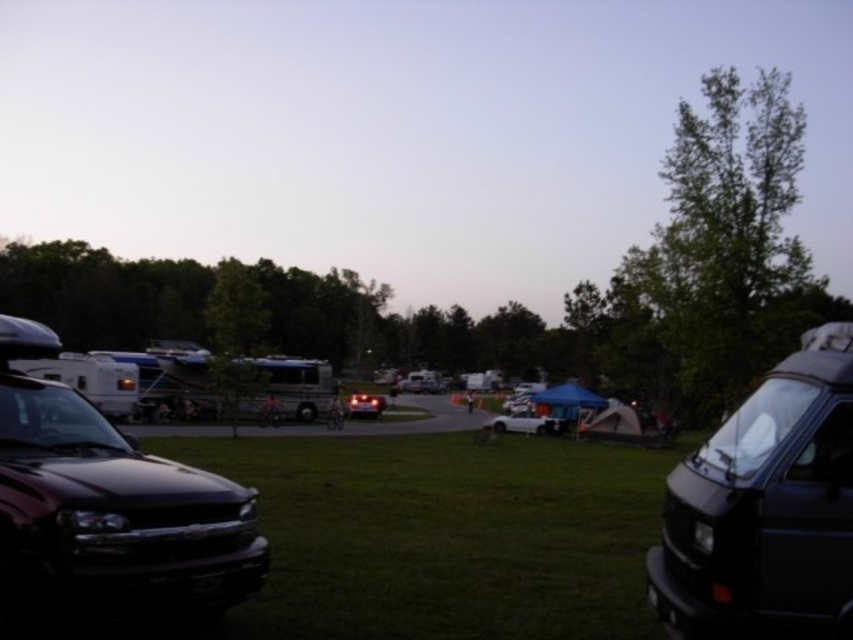
Which is below, green grass at center or shiny black suv at left?

green grass at center is lower down.

Which of these two, green grass at center or shiny black suv at left, stands shorter?

green grass at center is shorter.

Between point (410, 580) and point (15, 608), which one is positioned behind?

Point (410, 580)

I want to click on green grass at center, so [444, 536].

Which is more to the left, dark gray matte van at right or white matte car at center?

Positioned to the left is dark gray matte van at right.

Describe the element at coordinates (764, 506) in the screenshot. The image size is (853, 640). I see `dark gray matte van at right` at that location.

Locate an element on the screen. Image resolution: width=853 pixels, height=640 pixels. dark gray matte van at right is located at coordinates (764, 506).

Is point (97, 419) closer to camera compared to point (529, 426)?

Yes, it is.

Does point (56, 593) come behind point (531, 416)?

No, (56, 593) is closer to viewer.

Is point (67, 467) positioned after point (520, 428)?

That is False.

Where is `shiny black suv at left`? shiny black suv at left is located at coordinates (106, 506).